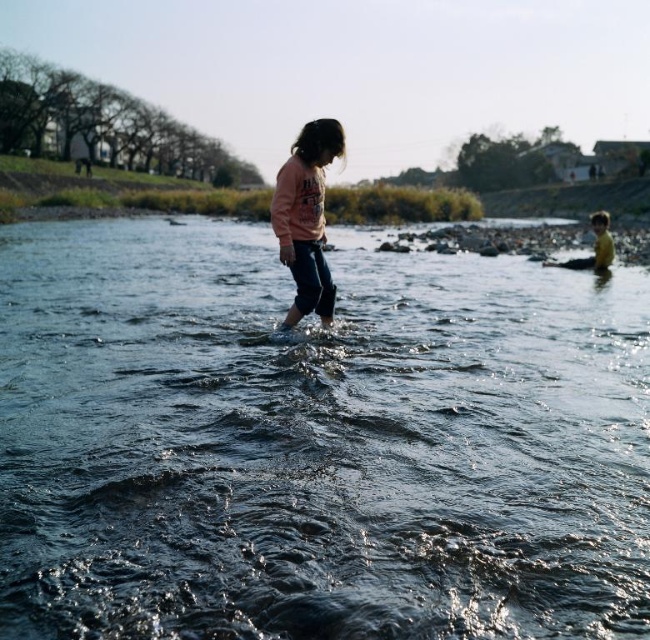
You are a parent looking for your child in the river scene. You see the pink fleece sweater at center and the yellow rubber boots at right. Which object is taller?

The yellow rubber boots at right are taller than the pink fleece sweater at center.

You are a parent watching your children play near the river. You see the clear water at center and the pink fleece sweater at center. Which object is higher up in the scene?

The clear water at center is much taller than the pink fleece sweater at center, so the clear water at center is higher up in the scene.